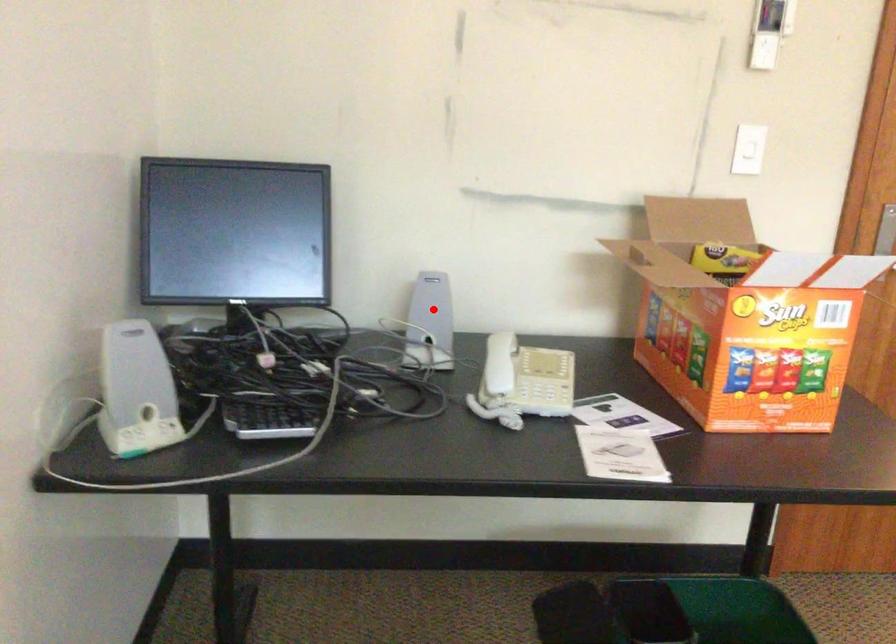
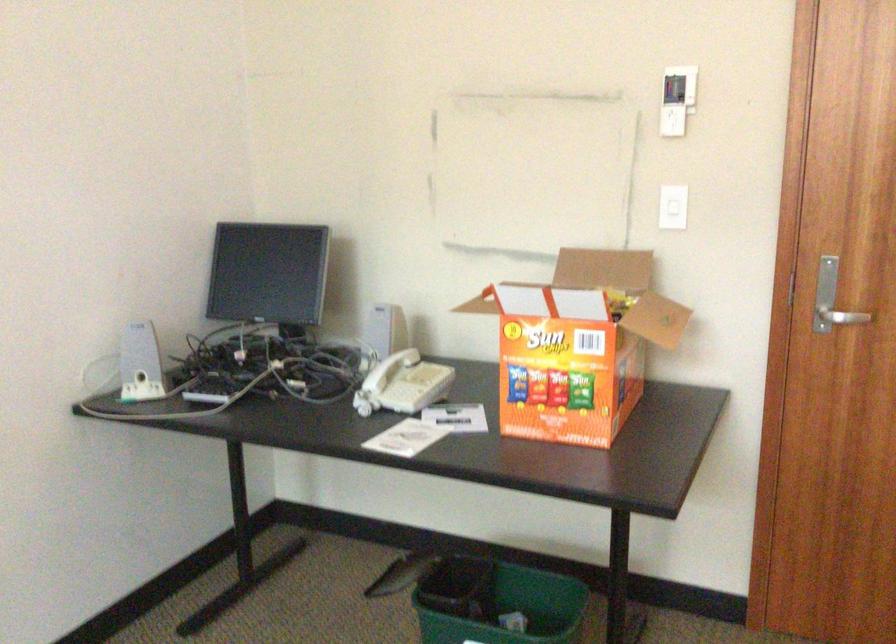
Where in the second image is the point corresponding to the highlighted location from the first image?

(384, 328)